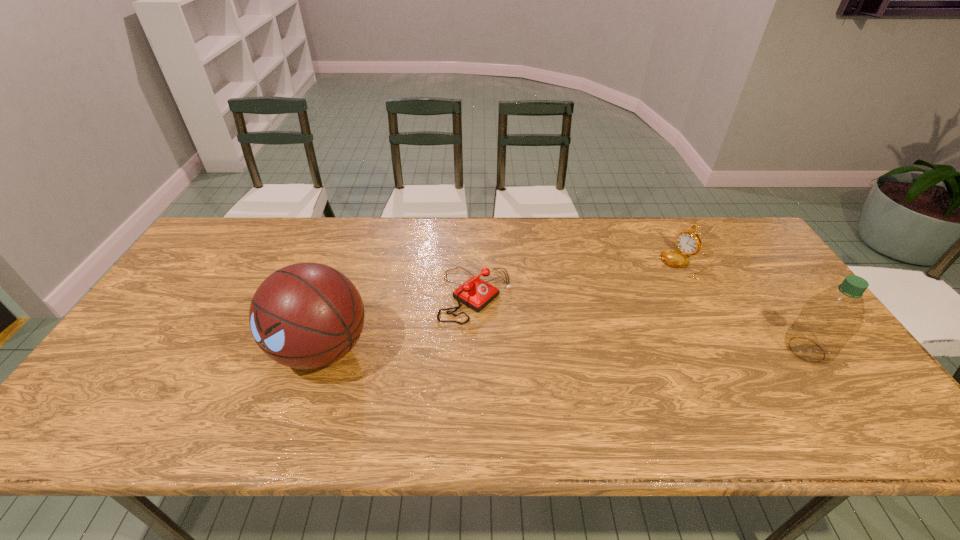
Where is `basketball`? The image size is (960, 540). basketball is located at coordinates (306, 316).

This screenshot has width=960, height=540. Find the location of `water bottle`. water bottle is located at coordinates (828, 320).

Where is `telephone`? The image size is (960, 540). telephone is located at coordinates (475, 293).

The height and width of the screenshot is (540, 960). In order to click on the third object from right to left in this screenshot , I will do `click(475, 293)`.

I want to click on pocket watch, so click(688, 242).

Image resolution: width=960 pixels, height=540 pixels. Find the location of `the third object from left to right`. the third object from left to right is located at coordinates (688, 242).

Find the location of a particular element. free space located 0.110m on the right of the basketball is located at coordinates (415, 349).

Find the location of a particular element. This screenshot has width=960, height=540. vacant position located 0.220m on the left of the water bottle is located at coordinates (698, 349).

Where is `free space located 0.210m on the dial of the shortest object`? This screenshot has width=960, height=540. free space located 0.210m on the dial of the shortest object is located at coordinates (570, 354).

This screenshot has width=960, height=540. I want to click on vacant space located 0.070m on the dial of the shortest object, so click(x=525, y=327).